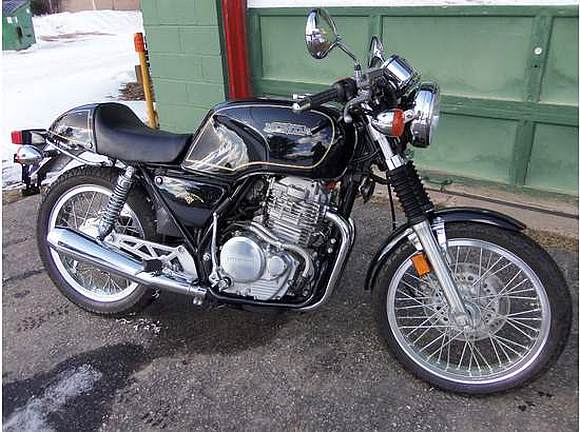
Identify the location of seat. This screenshot has height=432, width=580. click(145, 141).